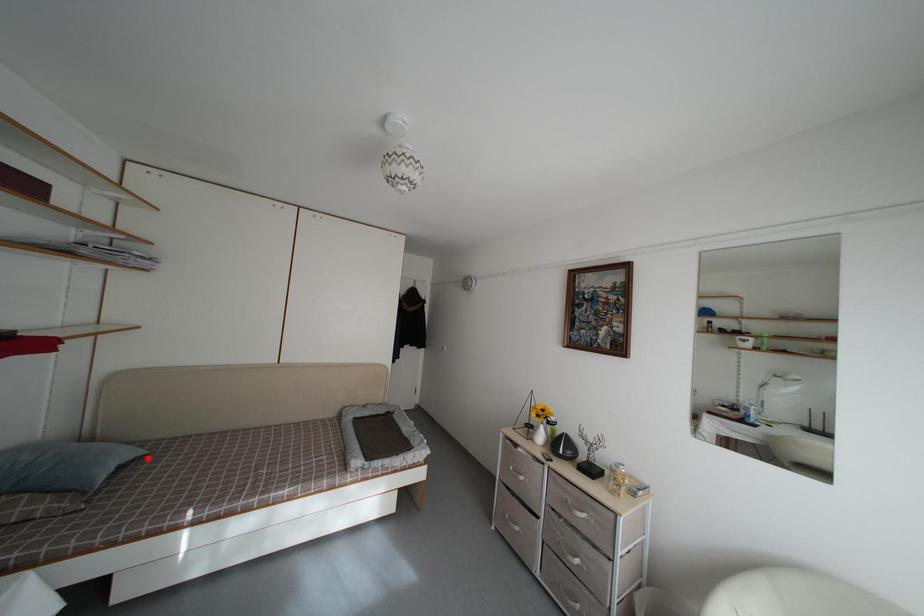
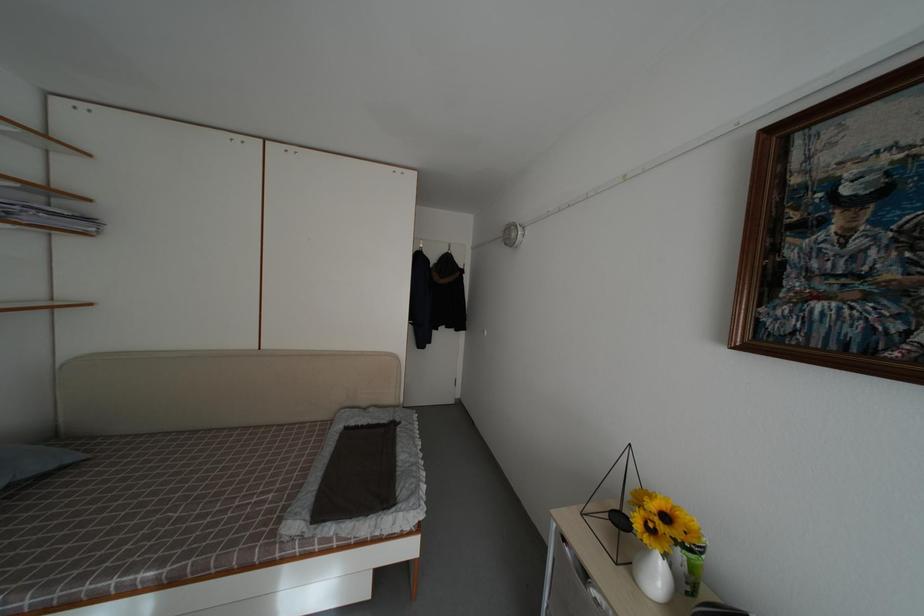
Locate, in the second image, the point that corresponds to the highlighted location in the first image.

(80, 464)